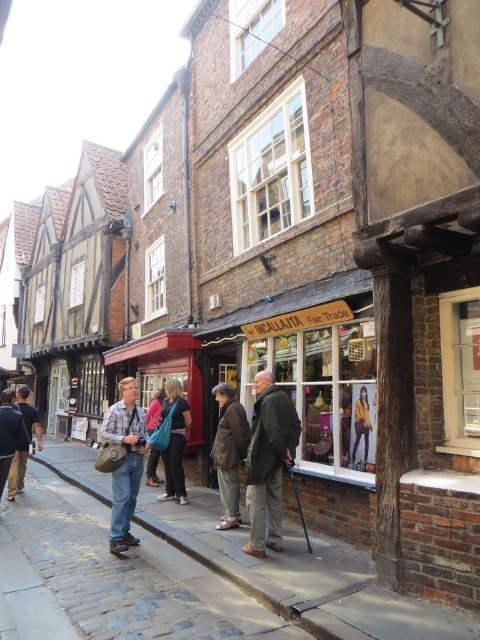
Is cobblestone pavement at lower left thinner than yellow fabric jacket at center?

In fact, cobblestone pavement at lower left might be wider than yellow fabric jacket at center.

How much distance is there between cobblestone pavement at lower left and yellow fabric jacket at center?

A distance of 1.87 meters exists between cobblestone pavement at lower left and yellow fabric jacket at center.

From the picture: Who is more forward, (x=264, y=593) or (x=359, y=410)?

Point (x=264, y=593)

Locate an element on the screen. This screenshot has width=480, height=640. cobblestone pavement at lower left is located at coordinates (302, 576).

Can you confirm if dark blue denim jacket at center is wider than dark brown leather jacket at left?

Yes.

Locate an element on the screen. The image size is (480, 640). dark blue denim jacket at center is located at coordinates (175, 442).

Is point (167, 492) closer to viewer compared to point (40, 440)?

Yes, point (167, 492) is closer to viewer.

This screenshot has height=640, width=480. In order to click on dark blue denim jacket at center in this screenshot , I will do `click(175, 442)`.

Does dark brown leather jacket at center appear under dark blue denim jacket at center?

Actually, dark brown leather jacket at center is above dark blue denim jacket at center.

Is dark brown leather jacket at center smaller than dark blue denim jacket at center?

Yes.

Which is behind, point (230, 419) or point (162, 420)?

The point (162, 420) is behind.

The width and height of the screenshot is (480, 640). I want to click on dark brown leather jacket at center, so click(228, 451).